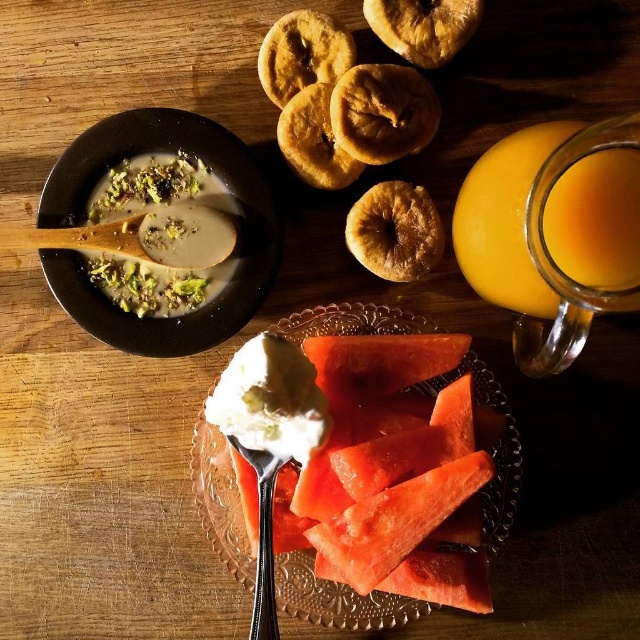
Question: Which point is farther from the camera taking this photo?

Choices:
 (A) (460, 417)
 (B) (472, 285)
 (C) (193, 300)

Answer: (B)

Question: Which object is the farthest from the white creamy soup at upper left?

Choices:
 (A) pink juicy watermelon slices at center
 (B) translucent glass jar of orange juice at upper right

Answer: (B)

Question: Is pink juicy watermelon slices at center below white creamy soup at upper left?

Choices:
 (A) no
 (B) yes

Answer: (B)

Question: Where is pink juicy watermelon slices at center located in relation to translucent glass jar of orange juice at upper right in the image?

Choices:
 (A) right
 (B) left

Answer: (B)

Question: Does pink juicy watermelon slices at center have a larger size compared to white creamy soup at upper left?

Choices:
 (A) yes
 (B) no

Answer: (A)

Question: Estimate the real-world distances between objects in this image. Which object is closer to the pink juicy watermelon slices at center?

Choices:
 (A) translucent glass jar of orange juice at upper right
 (B) white creamy soup at upper left

Answer: (A)